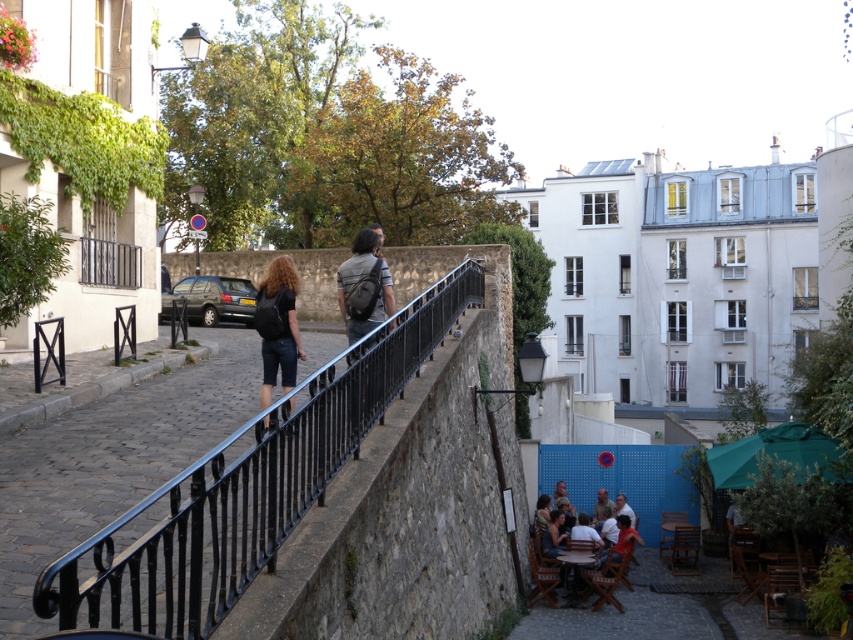
You are standing at the point labeled point (345, 321) and want to walk to the point labeled point (610, 504). Given that you can only move along the cobblestone street below the stone wall with the black metal railing, which direction should you head to reach your destination?

You should head towards the direction away from the viewer since point (610, 504) is further away than point (345, 321).

You are a delivery person who needs to place a package between the black matte backpack at center and the matte gray backpack at center. The package requires 6 feet of space. Can you fit it between them?

The black matte backpack at center is 6.57 feet away from the matte gray backpack at center, so yes, the package requiring 6 feet of space can fit between them since the distance is sufficient.

You are a delivery person who needs to place a package exactly at the coordinates given in the Objects Description. The package must be placed on the ground near the black matte backpack at center. Since the backpack is at point 0.509, 0.327, where should you place the package?

You should place the package near the black matte backpack at center at point [277,324] as instructed.